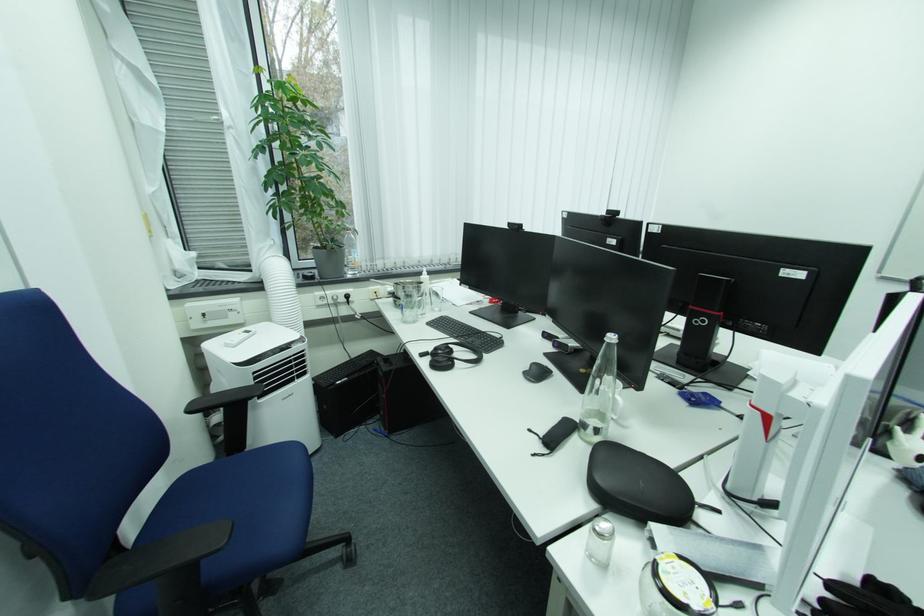
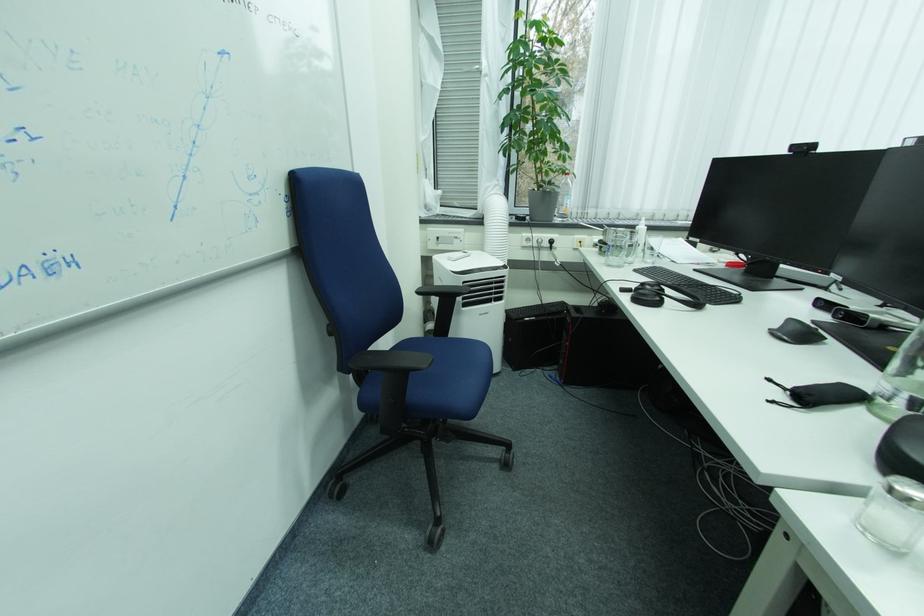
In the second image, find the point that corresponds to point 598,431 in the first image.

(906, 403)